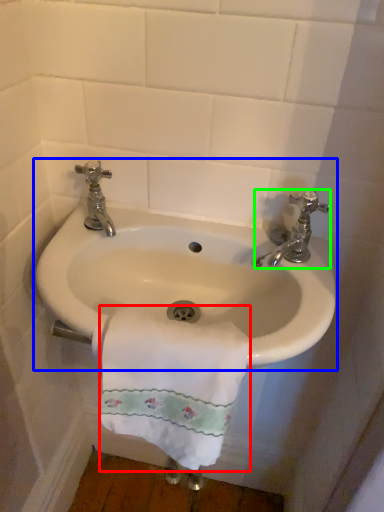
Question: Which object is the closest to the towel/napkin (highlighted by a red box)? Choose among these: sink (highlighted by a blue box) or tap (highlighted by a green box).

Choices:
 (A) sink
 (B) tap

Answer: (A)